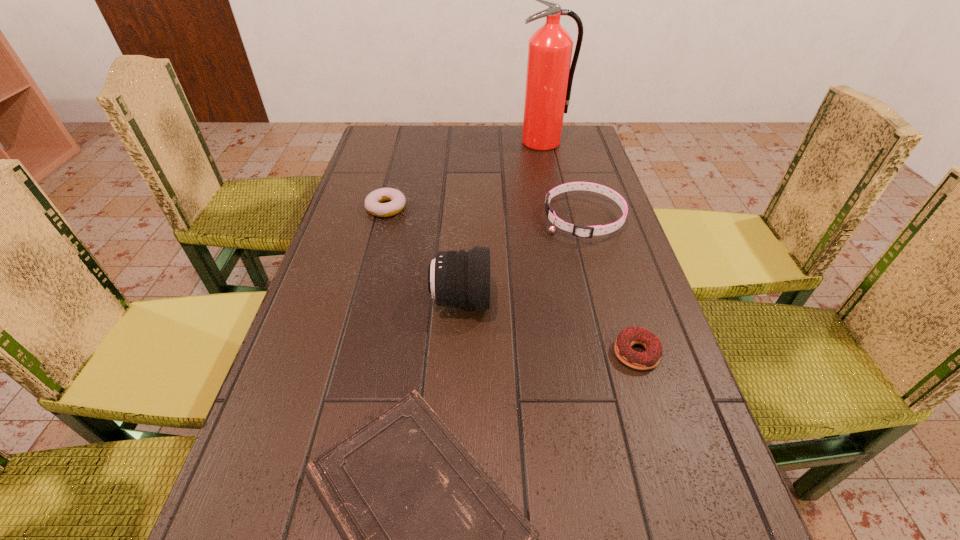
Point out which object is positioned as the third nearest to the farthest object. Please provide its 2D coordinates. Your answer should be formatted as a tuple, i.e. [(x, y)], where the tuple contains the x and y coordinates of a point satisfying the conditions above.

[(461, 278)]

The width and height of the screenshot is (960, 540). Find the location of `the closest object to the farther doughnut`. the closest object to the farther doughnut is located at coordinates (461, 278).

The height and width of the screenshot is (540, 960). What are the coordinates of `vacant area that satisfies the following two spatial constraints: 1. at the nozzle of the nearer doughnut; 2. on the right side of the tallest object` in the screenshot? It's located at (588, 353).

Where is `free space that satisfies the following two spatial constraints: 1. at the nozzle of the fire extinguisher; 2. on the right side of the nearer doughnut`? free space that satisfies the following two spatial constraints: 1. at the nozzle of the fire extinguisher; 2. on the right side of the nearer doughnut is located at coordinates (588, 353).

The height and width of the screenshot is (540, 960). Find the location of `free space in the image that satisfies the following two spatial constraints: 1. at the nozzle of the right doughnut; 2. on the right side of the fire extinguisher`. free space in the image that satisfies the following two spatial constraints: 1. at the nozzle of the right doughnut; 2. on the right side of the fire extinguisher is located at coordinates (588, 353).

At what (x,y) coordinates should I click in order to perform the action: click on vacant region that satisfies the following two spatial constraints: 1. at the nozzle of the farthest object; 2. on the left side of the right doughnut. Please return your answer as a coordinate pair (x, y). This screenshot has height=540, width=960. Looking at the image, I should click on (588, 353).

Find the location of a particular element. free location that satisfies the following two spatial constraints: 1. at the nozzle of the nearer doughnut; 2. on the right side of the tallest object is located at coordinates tap(588, 353).

Find the location of `free point that satisfies the following two spatial constraints: 1. at the front element of the nearer doughnut; 2. on the left side of the telephoto lens`. free point that satisfies the following two spatial constraints: 1. at the front element of the nearer doughnut; 2. on the left side of the telephoto lens is located at coordinates (458, 353).

Where is `free point that satisfies the following two spatial constraints: 1. at the front element of the telephoto lens; 2. on the left side of the second nearest object`? This screenshot has height=540, width=960. free point that satisfies the following two spatial constraints: 1. at the front element of the telephoto lens; 2. on the left side of the second nearest object is located at coordinates [458, 353].

Find the location of a particular element. The height and width of the screenshot is (540, 960). free location that satisfies the following two spatial constraints: 1. on the back side of the nearer doughnut; 2. at the front element of the second tallest object is located at coordinates (620, 300).